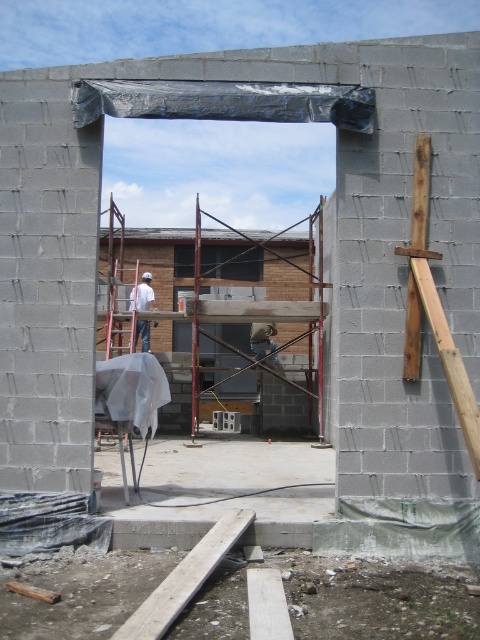
Question: Among these objects, which one is nearest to the camera?

Choices:
 (A) light brown leather helmet at center
 (B) white matte construction worker at left

Answer: (A)

Question: Is gray wood beam at lower center bigger than light brown leather helmet at center?

Choices:
 (A) yes
 (B) no

Answer: (B)

Question: Which object appears closest to the camera in this image?

Choices:
 (A) white matte construction worker at left
 (B) gray wood beam at lower center

Answer: (B)

Question: Does white matte construction worker at left have a greater width compared to light brown leather helmet at center?

Choices:
 (A) no
 (B) yes

Answer: (B)

Question: Which object appears closest to the camera in this image?

Choices:
 (A) light brown leather helmet at center
 (B) white matte construction worker at left

Answer: (A)

Question: Does gray wood beam at lower center lie behind white matte construction worker at left?

Choices:
 (A) no
 (B) yes

Answer: (A)